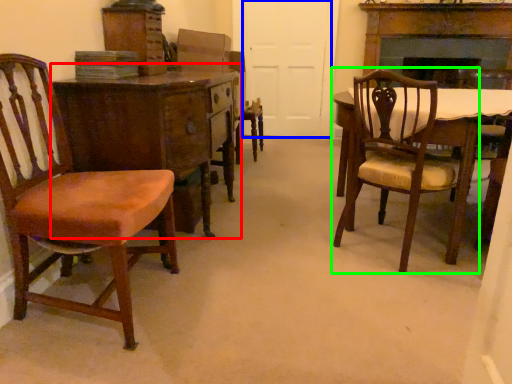
Question: Which object is the closest to the desk (highlighted by a red box)? Choose among these: door (highlighted by a blue box) or chair (highlighted by a green box).

Choices:
 (A) door
 (B) chair

Answer: (B)